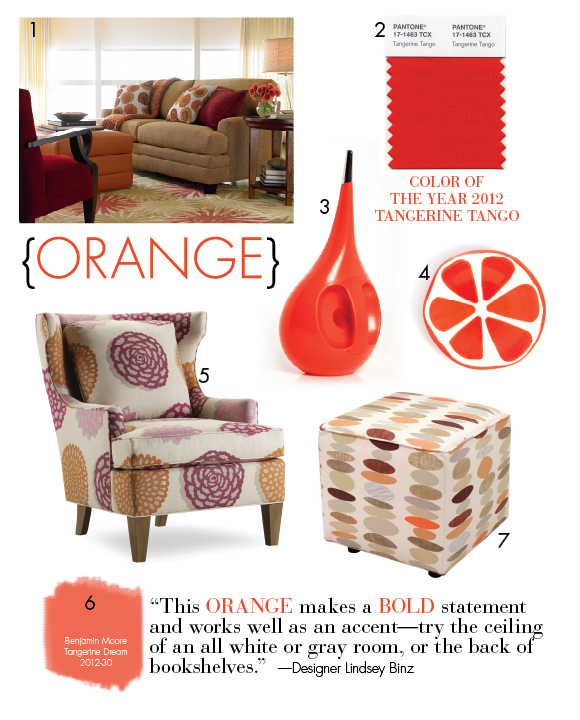
Locate an element on the screen. This screenshot has width=580, height=720. chair legs is located at coordinates (271, 531), (140, 544), (161, 520), (83, 517), (90, 217).